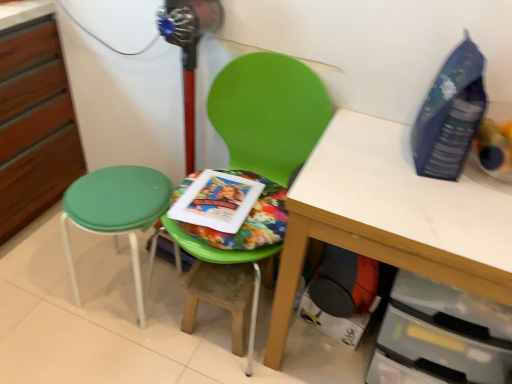
Question: From a real-world perspective, is white matte table at center located higher than blue plastic bottle at upper right?

Choices:
 (A) no
 (B) yes

Answer: (A)

Question: Considering the relative sizes of white matte table at center and blue plastic bottle at upper right in the image provided, is white matte table at center thinner than blue plastic bottle at upper right?

Choices:
 (A) no
 (B) yes

Answer: (A)

Question: Can blue plastic bottle at upper right be found inside white matte table at center?

Choices:
 (A) yes
 (B) no

Answer: (B)

Question: Is white matte table at center not within blue plastic bottle at upper right?

Choices:
 (A) yes
 (B) no

Answer: (A)

Question: Is white matte table at center far from blue plastic bottle at upper right?

Choices:
 (A) yes
 (B) no

Answer: (B)

Question: From the image's perspective, is multicolored fabric paperback book at center located above or below green plastic chair at center?

Choices:
 (A) below
 (B) above

Answer: (B)

Question: Considering the positions of multicolored fabric paperback book at center and green plastic chair at center in the image, is multicolored fabric paperback book at center wider or thinner than green plastic chair at center?

Choices:
 (A) thin
 (B) wide

Answer: (A)

Question: Looking at the image, does multicolored fabric paperback book at center seem bigger or smaller compared to green plastic chair at center?

Choices:
 (A) small
 (B) big

Answer: (A)

Question: Would you say multicolored fabric paperback book at center is to the left or to the right of green plastic chair at center in the picture?

Choices:
 (A) left
 (B) right

Answer: (A)

Question: In terms of size, does multicolored fabric paperback book at center appear bigger or smaller than green fabric stool at left?

Choices:
 (A) big
 (B) small

Answer: (B)

Question: From a real-world perspective, is multicolored fabric paperback book at center physically located above or below green fabric stool at left?

Choices:
 (A) below
 (B) above

Answer: (B)

Question: From their relative heights in the image, would you say multicolored fabric paperback book at center is taller or shorter than green fabric stool at left?

Choices:
 (A) tall
 (B) short

Answer: (B)

Question: Considering their positions, is multicolored fabric paperback book at center located in front of or behind green fabric stool at left?

Choices:
 (A) front
 (B) behind

Answer: (A)

Question: Looking at their shapes, would you say wooden step stool at center is wider or thinner than green fabric stool at left?

Choices:
 (A) thin
 (B) wide

Answer: (A)

Question: Is wooden step stool at center bigger or smaller than green fabric stool at left?

Choices:
 (A) big
 (B) small

Answer: (B)